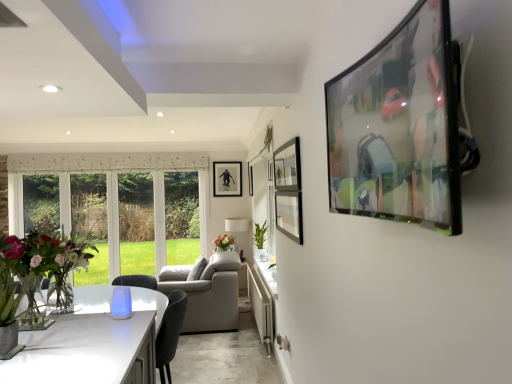
Question: Considering the relative sizes of matte black picture frame at center, the second picture frame in the front-to-back sequence, and green glossy plant at center in the image provided, is matte black picture frame at center, the second picture frame in the front-to-back sequence, wider than green glossy plant at center?

Choices:
 (A) yes
 (B) no

Answer: (B)

Question: Is matte black picture frame at center, the 2th picture frame positioned from the back, facing away from green glossy plant at center?

Choices:
 (A) yes
 (B) no

Answer: (B)

Question: Is there a large distance between matte black picture frame at center, arranged as the second picture frame when viewed from the right, and green glossy plant at center?

Choices:
 (A) no
 (B) yes

Answer: (A)

Question: Does matte black picture frame at center, the second picture frame in the front-to-back sequence, lie in front of green glossy plant at center?

Choices:
 (A) no
 (B) yes

Answer: (A)

Question: From the image's perspective, would you say matte black picture frame at center, the 2th picture frame positioned from the back, is positioned over green glossy plant at center?

Choices:
 (A) no
 (B) yes

Answer: (B)

Question: Is matte black picture frame at center, the 2th picture frame positioned from the back, taller or shorter than matte black tv at upper right, arranged as the first picture frame when viewed from the right?

Choices:
 (A) tall
 (B) short

Answer: (A)

Question: Considering their positions, is matte black picture frame at center, the 2th picture frame positioned from the back, located in front of or behind matte black tv at upper right, the 3th picture frame from the left?

Choices:
 (A) front
 (B) behind

Answer: (B)

Question: Choose the correct answer: Is matte black picture frame at center, the second picture frame when ordered from left to right, inside matte black tv at upper right, the 3th picture frame from the left, or outside it?

Choices:
 (A) inside
 (B) outside

Answer: (B)

Question: Does point (247, 170) appear closer or farther from the camera than point (437, 86)?

Choices:
 (A) farther
 (B) closer

Answer: (A)

Question: From the image's perspective, is metallic silver picture frame at center, placed as the 3th picture frame when sorted from front to back, above or below white fabric lampshade at center?

Choices:
 (A) above
 (B) below

Answer: (A)

Question: Considering the positions of point (214, 183) and point (232, 230), is point (214, 183) closer or farther from the camera than point (232, 230)?

Choices:
 (A) farther
 (B) closer

Answer: (B)

Question: Choose the correct answer: Is metallic silver picture frame at center, acting as the third picture frame starting from the right, inside white fabric lampshade at center or outside it?

Choices:
 (A) inside
 (B) outside

Answer: (B)

Question: Is metallic silver picture frame at center, acting as the third picture frame starting from the right, in front of or behind white fabric lampshade at center in the image?

Choices:
 (A) behind
 (B) front

Answer: (A)

Question: Is matte glass vase at left wider or thinner than matte black tv at upper right, the 3th picture frame from the left?

Choices:
 (A) wide
 (B) thin

Answer: (A)

Question: Based on their sizes in the image, would you say matte glass vase at left is bigger or smaller than matte black tv at upper right, arranged as the first picture frame when viewed from the right?

Choices:
 (A) big
 (B) small

Answer: (A)